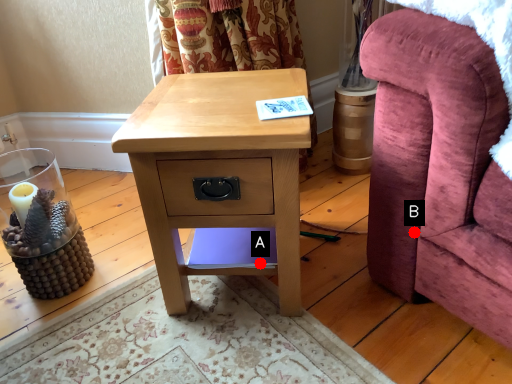
Question: Two points are circled on the image, labeled by A and B beside each circle. Which of the following is the closest to the observer?

Choices:
 (A) A is closer
 (B) B is closer

Answer: (B)